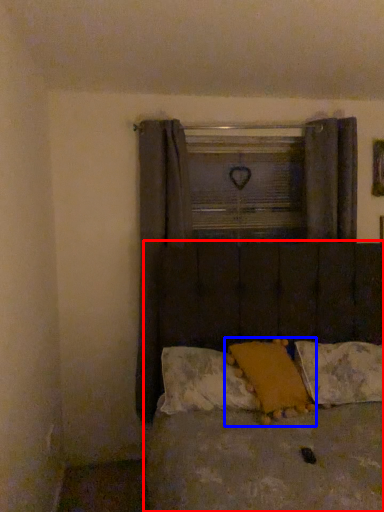
Question: Which of the following is the farthest to the observer, bed (highlighted by a red box) or pillow (highlighted by a blue box)?

Choices:
 (A) bed
 (B) pillow

Answer: (B)